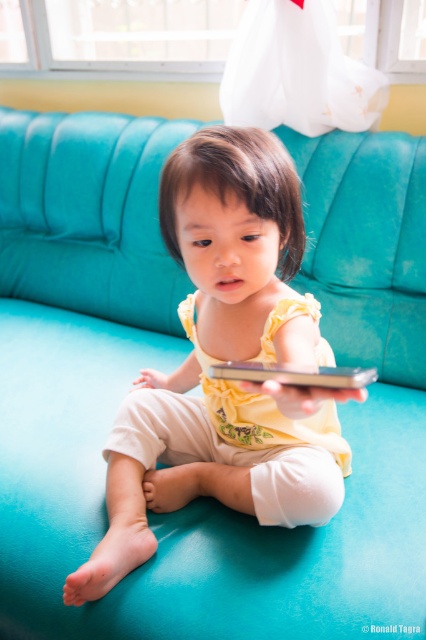
Question: Is yellow fabric child at center to the left of silver metallic tablet at center from the viewer's perspective?

Choices:
 (A) yes
 (B) no

Answer: (A)

Question: Can you confirm if yellow fabric child at center is positioned to the right of silver metallic tablet at center?

Choices:
 (A) no
 (B) yes

Answer: (A)

Question: Which of the following is the closest to the observer?

Choices:
 (A) silver metallic tablet at center
 (B) yellow fabric child at center

Answer: (A)

Question: Which point is farther from the camera taking this photo?

Choices:
 (A) (313, 387)
 (B) (138, 515)

Answer: (B)

Question: From the image, what is the correct spatial relationship of yellow fabric child at center in relation to silver metallic tablet at center?

Choices:
 (A) below
 (B) above

Answer: (A)